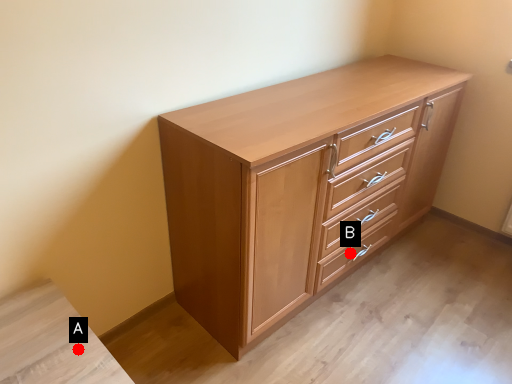
Question: Two points are circled on the image, labeled by A and B beside each circle. Which point is further to the camera?

Choices:
 (A) A is further
 (B) B is further

Answer: (B)